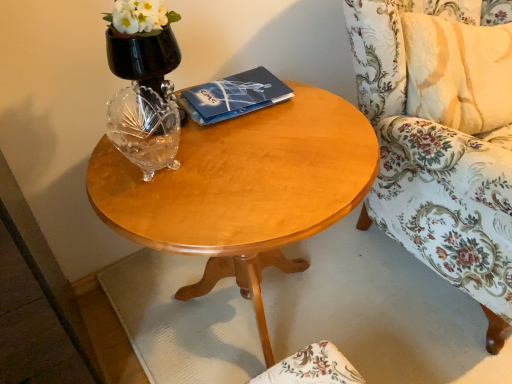
Question: From a real-world perspective, is dark blue matte paper at center below floral fabric chair at right?

Choices:
 (A) no
 (B) yes

Answer: (A)

Question: Is there a large distance between dark blue matte paper at center and floral fabric chair at right?

Choices:
 (A) yes
 (B) no

Answer: (B)

Question: Is dark blue matte paper at center taller than floral fabric chair at right?

Choices:
 (A) yes
 (B) no

Answer: (B)

Question: Is the depth of dark blue matte paper at center less than that of floral fabric chair at right?

Choices:
 (A) no
 (B) yes

Answer: (A)

Question: Can you confirm if dark blue matte paper at center is bigger than floral fabric chair at right?

Choices:
 (A) yes
 (B) no

Answer: (B)

Question: Is dark blue matte paper at center aimed at floral fabric chair at right?

Choices:
 (A) yes
 (B) no

Answer: (B)

Question: Is dark blue matte paper at center further to camera compared to light wood/finish coffee table at center?

Choices:
 (A) yes
 (B) no

Answer: (A)

Question: Is dark blue matte paper at center located outside light wood/finish coffee table at center?

Choices:
 (A) no
 (B) yes

Answer: (A)

Question: From the image's perspective, does dark blue matte paper at center appear lower than light wood/finish coffee table at center?

Choices:
 (A) yes
 (B) no

Answer: (B)

Question: From a real-world perspective, is dark blue matte paper at center located beneath light wood/finish coffee table at center?

Choices:
 (A) yes
 (B) no

Answer: (B)

Question: Is light wood/finish coffee table at center at the back of dark blue matte paper at center?

Choices:
 (A) no
 (B) yes

Answer: (A)

Question: Can you confirm if dark blue matte paper at center is bigger than light wood/finish coffee table at center?

Choices:
 (A) no
 (B) yes

Answer: (A)

Question: From the image's perspective, would you say black glass vase at upper left is positioned over floral fabric chair at right?

Choices:
 (A) no
 (B) yes

Answer: (B)